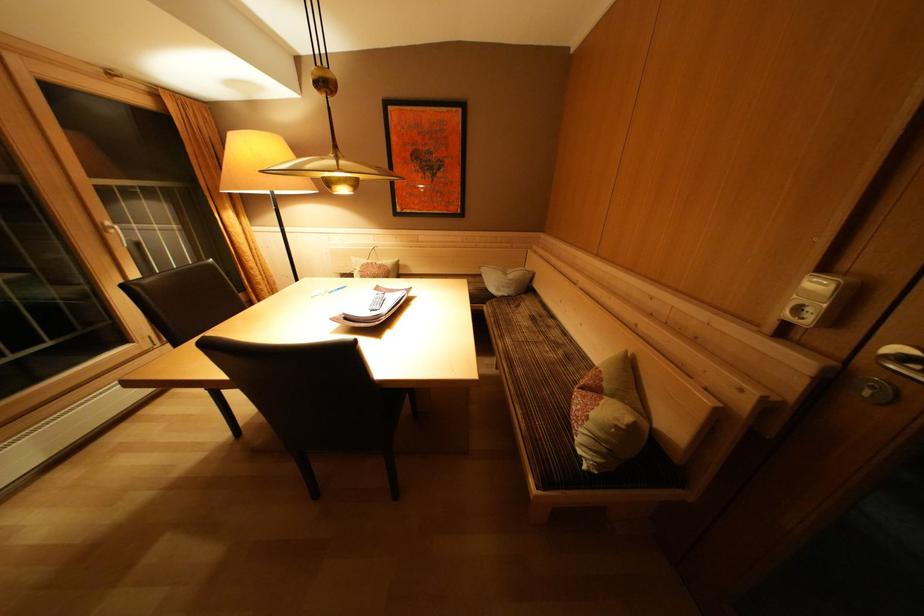
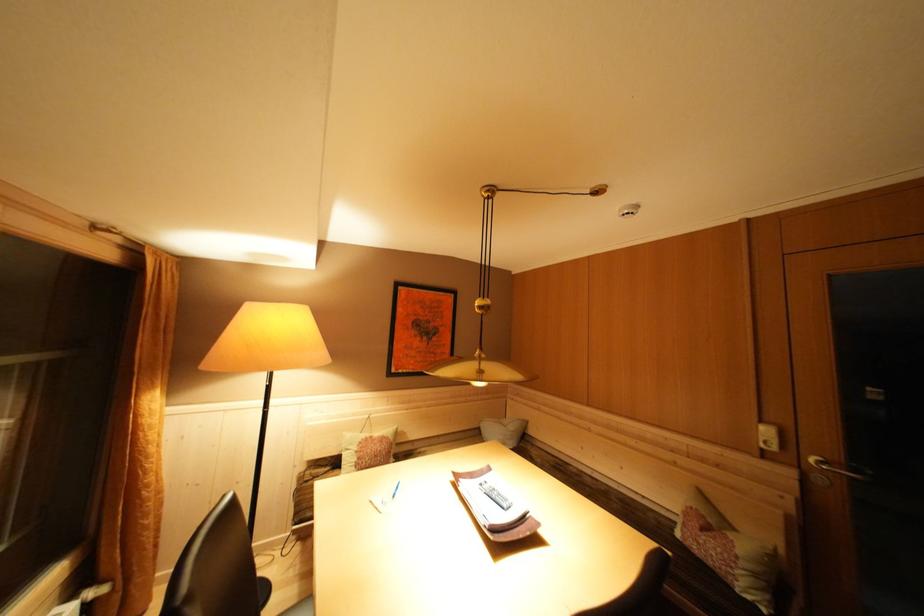
Where in the second image is the point corresponding to [600,419] from the first image?

(746, 557)